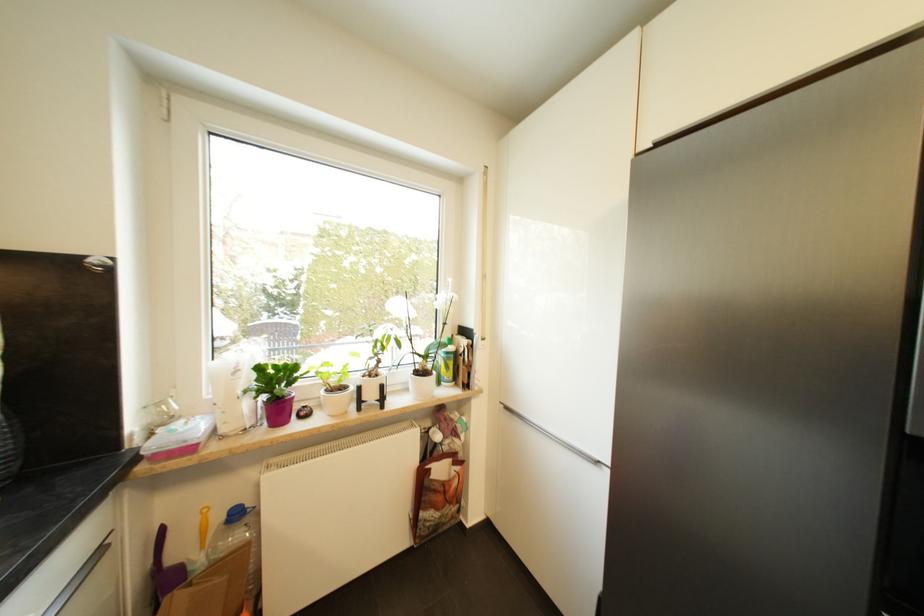
Where is `yellow plastic tool`? The width and height of the screenshot is (924, 616). yellow plastic tool is located at coordinates (202, 527).